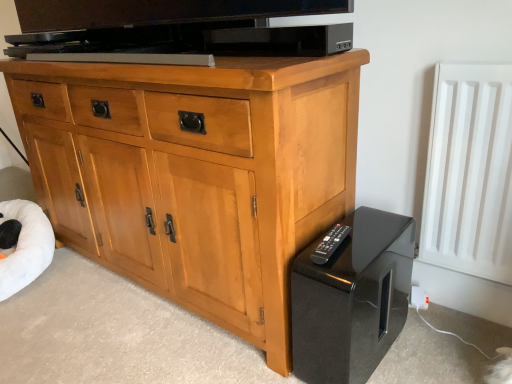
Question: Is white matte radiator at right positioned with its back to black glossy speaker at lower right?

Choices:
 (A) no
 (B) yes

Answer: (A)

Question: Can you confirm if white matte radiator at right is wider than black glossy speaker at lower right?

Choices:
 (A) no
 (B) yes

Answer: (A)

Question: Is white matte radiator at right at the left side of black glossy speaker at lower right?

Choices:
 (A) no
 (B) yes

Answer: (A)

Question: Considering the relative sizes of white matte radiator at right and black glossy speaker at lower right in the image provided, is white matte radiator at right bigger than black glossy speaker at lower right?

Choices:
 (A) yes
 (B) no

Answer: (B)

Question: Is black glossy speaker at lower right inside white matte radiator at right?

Choices:
 (A) no
 (B) yes

Answer: (A)

Question: From their relative heights in the image, would you say white plush bean bag at lower left is taller or shorter than black glossy speaker at lower right?

Choices:
 (A) short
 (B) tall

Answer: (A)

Question: From the image's perspective, is white plush bean bag at lower left above or below black glossy speaker at lower right?

Choices:
 (A) below
 (B) above

Answer: (B)

Question: Considering the positions of white plush bean bag at lower left and black glossy speaker at lower right in the image, is white plush bean bag at lower left wider or thinner than black glossy speaker at lower right?

Choices:
 (A) wide
 (B) thin

Answer: (A)

Question: Considering the positions of point (11, 284) and point (360, 354), is point (11, 284) closer or farther from the camera than point (360, 354)?

Choices:
 (A) closer
 (B) farther

Answer: (B)

Question: In terms of width, does light wood cabinet at center look wider or thinner when compared to white matte radiator at right?

Choices:
 (A) thin
 (B) wide

Answer: (B)

Question: From a real-world perspective, is light wood cabinet at center positioned above or below white matte radiator at right?

Choices:
 (A) above
 (B) below

Answer: (B)

Question: In the image, is light wood cabinet at center positioned in front of or behind white matte radiator at right?

Choices:
 (A) front
 (B) behind

Answer: (A)

Question: Considering the positions of point (224, 288) and point (471, 208), is point (224, 288) closer or farther from the camera than point (471, 208)?

Choices:
 (A) farther
 (B) closer

Answer: (A)

Question: In terms of size, does black glossy speaker at lower right appear bigger or smaller than black plastic remote at lower right?

Choices:
 (A) small
 (B) big

Answer: (B)

Question: Based on their positions, is black glossy speaker at lower right located to the left or right of black plastic remote at lower right?

Choices:
 (A) left
 (B) right

Answer: (B)